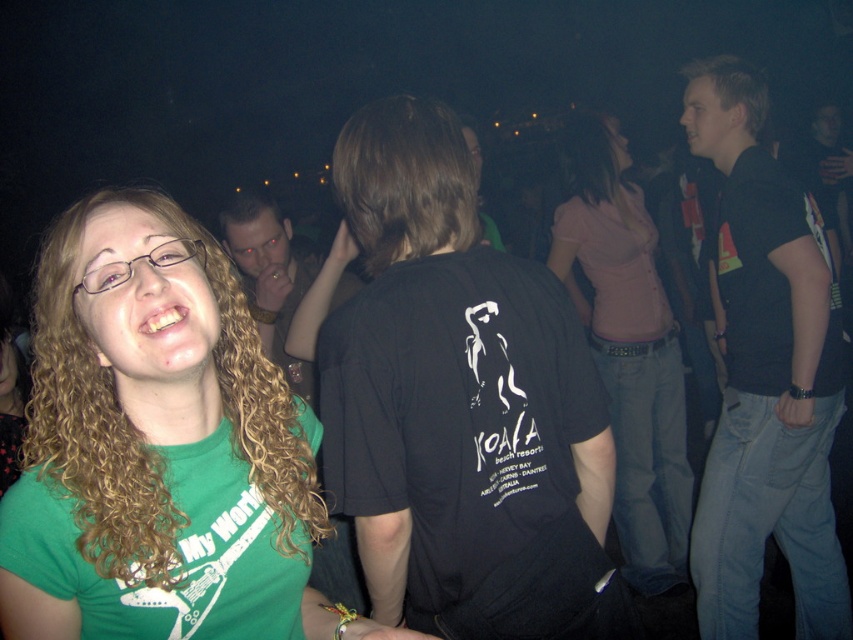
What is located at the coordinates point (155, 444)?

The green matte t shirt at center is located at point (155, 444).

What are the coordinates of the matte black shirt at center?

The coordinates of the matte black shirt at center are at point (x=268, y=276).